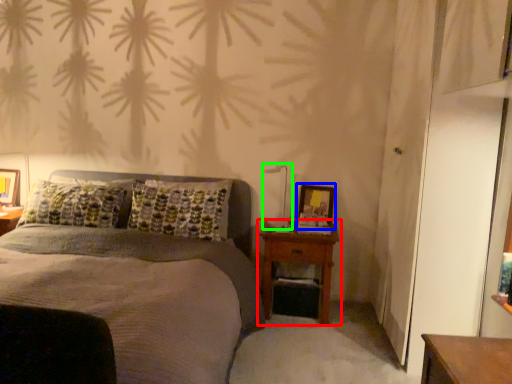
Question: Which object is the closest to the nightstand (highlighted by a red box)? Choose among these: picture frame (highlighted by a blue box) or bedside lamp (highlighted by a green box).

Choices:
 (A) picture frame
 (B) bedside lamp

Answer: (A)